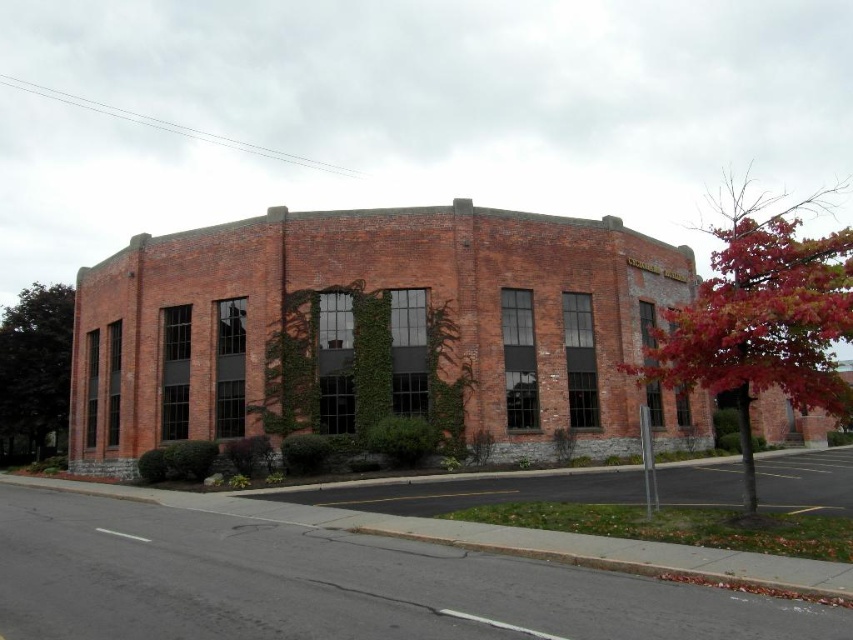
You are standing in front of the circular brick building and notice a point marked at coordinates (761, 316). What object is located at this point?

The point at coordinates (761, 316) indicates a red leafy tree at right.

You are standing in front of the circular brick building and notice two trees nearby. The red leafy tree at right and the green leafy tree at left. Which tree would cast a larger shadow during the afternoon when the sun is to the west?

The red leafy tree at right is bigger than the green leafy tree at left, so it would cast a larger shadow during the afternoon when the sun is to the west.

You are standing in front of the circular brick building and want to know which tree is taller between the red leafy tree at right and the green leafy tree at left. Can you determine this based on their positions?

The red leafy tree at right is much taller than the green leafy tree at left, so it is the taller one between them.